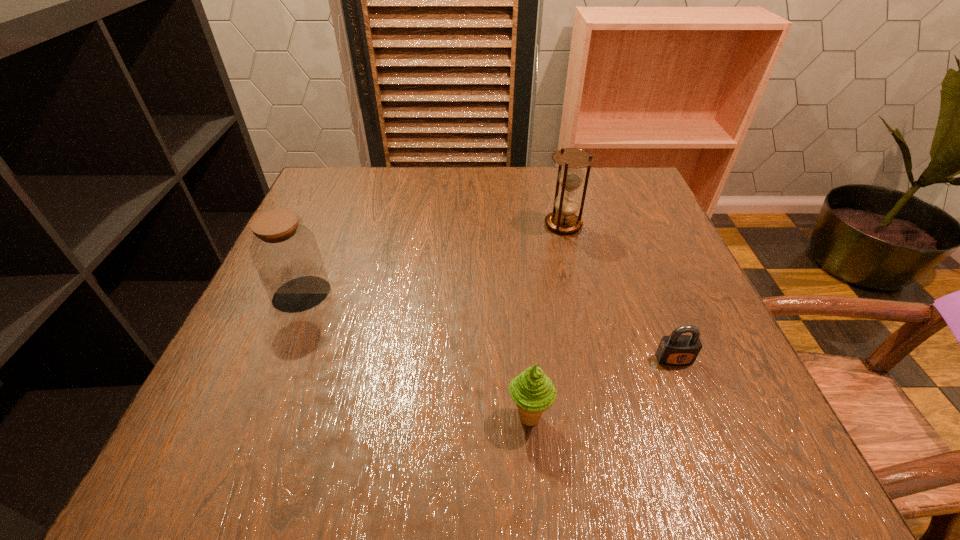
In order to click on hourglass in this screenshot , I will do pyautogui.click(x=563, y=219).

This screenshot has width=960, height=540. I want to click on the farthest object, so (563, 219).

This screenshot has height=540, width=960. I want to click on the leftmost object, so click(285, 253).

Where is `the third nearest object`? the third nearest object is located at coordinates (285, 253).

The image size is (960, 540). I want to click on icecream, so click(533, 392).

I want to click on the second object from left to right, so click(x=533, y=392).

Locate an element on the screen. the third farthest object is located at coordinates click(x=674, y=350).

What are the coordinates of `padlock` in the screenshot? It's located at (674, 350).

This screenshot has width=960, height=540. In order to click on vacant space situated on the back of the farthest object in this screenshot , I will do tap(555, 187).

At what (x,y) coordinates should I click in order to perform the action: click on free spot located on the back of the third nearest object. Please return your answer as a coordinate pair (x, y). Looking at the image, I should click on point(318,256).